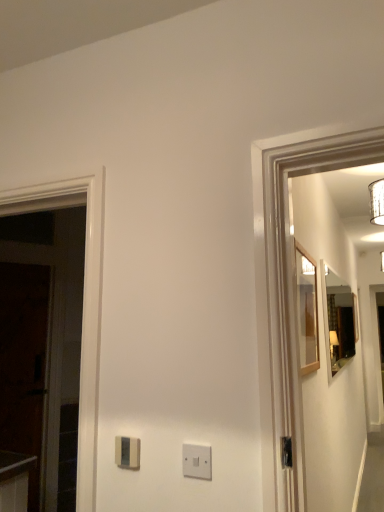
Question: Considering the relative sizes of white plastic light switch at center, the 2th light switch from the back, and satin beige light switch at center, the 1th light switch in the left-to-right sequence, in the image provided, is white plastic light switch at center, the 2th light switch from the back, wider than satin beige light switch at center, the 1th light switch in the left-to-right sequence,?

Choices:
 (A) yes
 (B) no

Answer: (B)

Question: Does white plastic light switch at center, which is the 1th light switch from right to left, appear on the right side of satin beige light switch at center, which is counted as the second light switch, starting from the right?

Choices:
 (A) yes
 (B) no

Answer: (A)

Question: Is white plastic light switch at center, which is the 1th light switch from right to left, facing towards satin beige light switch at center, the 1th light switch in the left-to-right sequence?

Choices:
 (A) no
 (B) yes

Answer: (A)

Question: Does white plastic light switch at center, marked as the first light switch in a front-to-back arrangement, contain satin beige light switch at center, marked as the 1th light switch in a back-to-front arrangement?

Choices:
 (A) no
 (B) yes

Answer: (A)

Question: Is white plastic light switch at center, marked as the first light switch in a front-to-back arrangement, directly adjacent to satin beige light switch at center, the 1th light switch in the left-to-right sequence?

Choices:
 (A) yes
 (B) no

Answer: (B)

Question: In terms of height, does satin beige light switch at center, which is counted as the second light switch, starting from the right, look taller or shorter compared to dark wood door at left?

Choices:
 (A) short
 (B) tall

Answer: (A)

Question: Is satin beige light switch at center, the second light switch when ordered from front to back, bigger or smaller than dark wood door at left?

Choices:
 (A) small
 (B) big

Answer: (A)

Question: Is point (130, 455) positioned closer to the camera than point (16, 294)?

Choices:
 (A) closer
 (B) farther

Answer: (A)

Question: From the image's perspective, is satin beige light switch at center, the second light switch when ordered from front to back, above or below dark wood door at left?

Choices:
 (A) above
 (B) below

Answer: (A)

Question: Considering the positions of matte wooden mirror at right, which is the second mirror from left to right, and dark wood door at left in the image, is matte wooden mirror at right, which is the second mirror from left to right, taller or shorter than dark wood door at left?

Choices:
 (A) tall
 (B) short

Answer: (B)

Question: From a real-world perspective, is matte wooden mirror at right, acting as the second mirror starting from the front, physically located above or below dark wood door at left?

Choices:
 (A) below
 (B) above

Answer: (B)

Question: From the image's perspective, is matte wooden mirror at right, which is the first mirror in right-to-left order, above or below dark wood door at left?

Choices:
 (A) above
 (B) below

Answer: (A)

Question: In terms of width, does matte wooden mirror at right, which is the second mirror from left to right, look wider or thinner when compared to dark wood door at left?

Choices:
 (A) thin
 (B) wide

Answer: (A)

Question: From the image's perspective, is white plastic light switch at center, which is the 1th light switch from right to left, positioned above or below satin beige light switch at center, marked as the 1th light switch in a back-to-front arrangement?

Choices:
 (A) below
 (B) above

Answer: (B)

Question: Relative to satin beige light switch at center, the second light switch when ordered from front to back, is white plastic light switch at center, marked as the first light switch in a front-to-back arrangement, in front or behind?

Choices:
 (A) behind
 (B) front

Answer: (B)